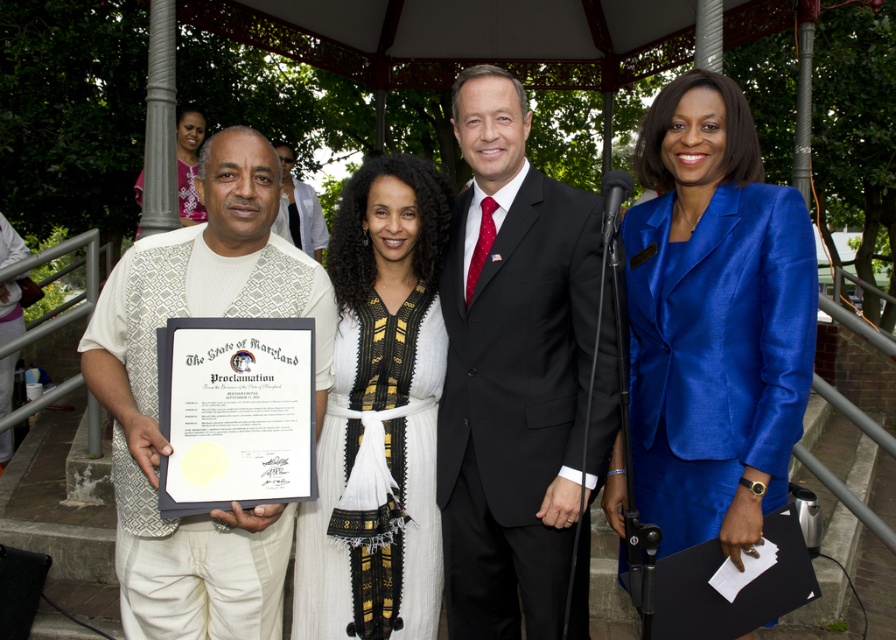
You are a photographer positioned at the front of the gazebo. You need to capture a clear photo of the black suit at center and the matte white shirt at center. Which one is closer to the camera?

The black suit at center is closer to the camera because it is in front of the matte white shirt at center.

You are a photographer positioned at the center of the gazebo. You want to capture a photo of the pink floral dress at upper left. Which direction should you point your camera to ensure the dress is in the frame?

To capture the pink floral dress at upper left, point your camera towards the upper left direction since that is where the dress is located.

What is the color of the fabric located at the coordinates point (154,397)?

The fabric at point (154,397) is white textured fabric at left.